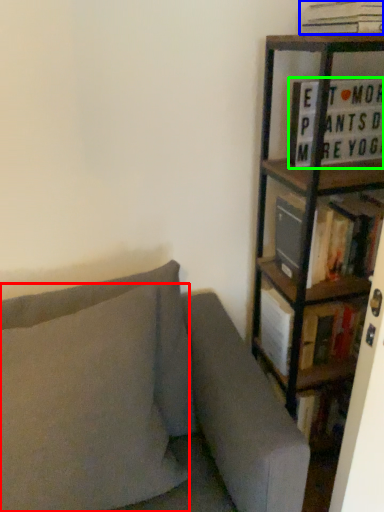
Question: Considering the real-world distances, which object is farthest from pillow (highlighted by a red box)? book (highlighted by a blue box) or book (highlighted by a green box)?

Choices:
 (A) book
 (B) book

Answer: (A)